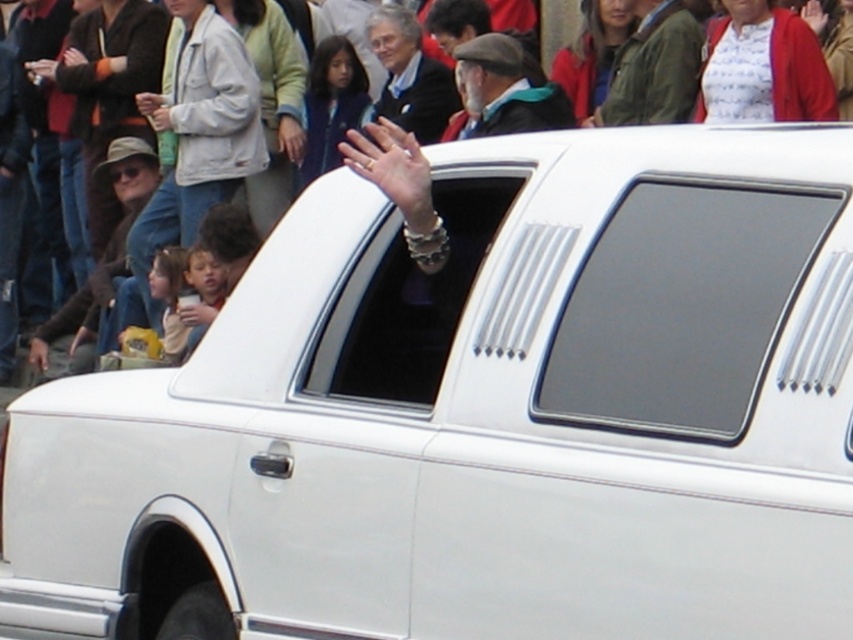
Identify the location of matte black window at center. The image size is (853, 640). (682, 307).

This screenshot has width=853, height=640. What do you see at coordinates (682, 307) in the screenshot? I see `matte black window at center` at bounding box center [682, 307].

This screenshot has width=853, height=640. What do you see at coordinates (682, 307) in the screenshot?
I see `matte black window at center` at bounding box center [682, 307].

I want to click on matte black window at center, so click(x=682, y=307).

Does point (33, 209) come behind point (519, 74)?

That is True.

Which is behind, point (583, 10) or point (543, 124)?

Positioned behind is point (583, 10).

The height and width of the screenshot is (640, 853). What do you see at coordinates (53, 227) in the screenshot?
I see `matte white car at center` at bounding box center [53, 227].

Locate an element on the screen. This screenshot has width=853, height=640. matte white car at center is located at coordinates (53, 227).

Is green textured jacket at upper center positioned behind matte black suit at center?

No, it is in front of matte black suit at center.

Does green textured jacket at upper center have a greater height compared to matte black suit at center?

No, green textured jacket at upper center is not taller than matte black suit at center.

Which is behind, point (637, 52) or point (425, 144)?

Point (425, 144)

The width and height of the screenshot is (853, 640). I want to click on green textured jacket at upper center, so click(x=653, y=68).